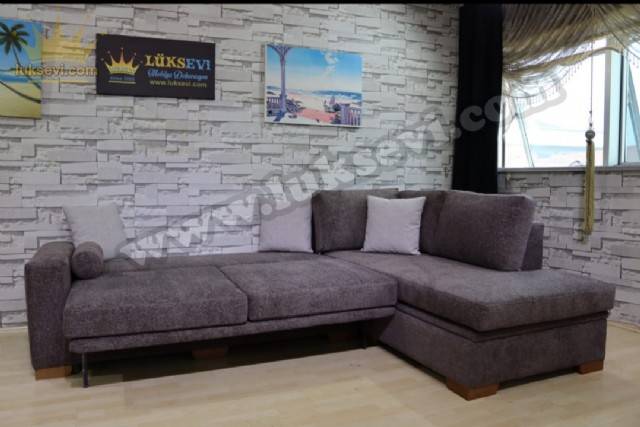
What are the coordinates of `curtain` in the screenshot? It's located at (561, 32).